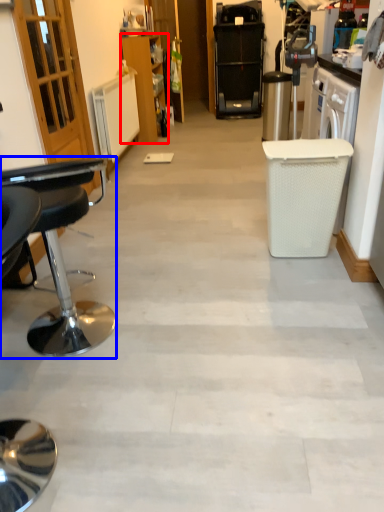
Question: Which object appears closest to the camera in this image, cabinetry (highlighted by a red box) or chair (highlighted by a blue box)?

Choices:
 (A) cabinetry
 (B) chair

Answer: (B)